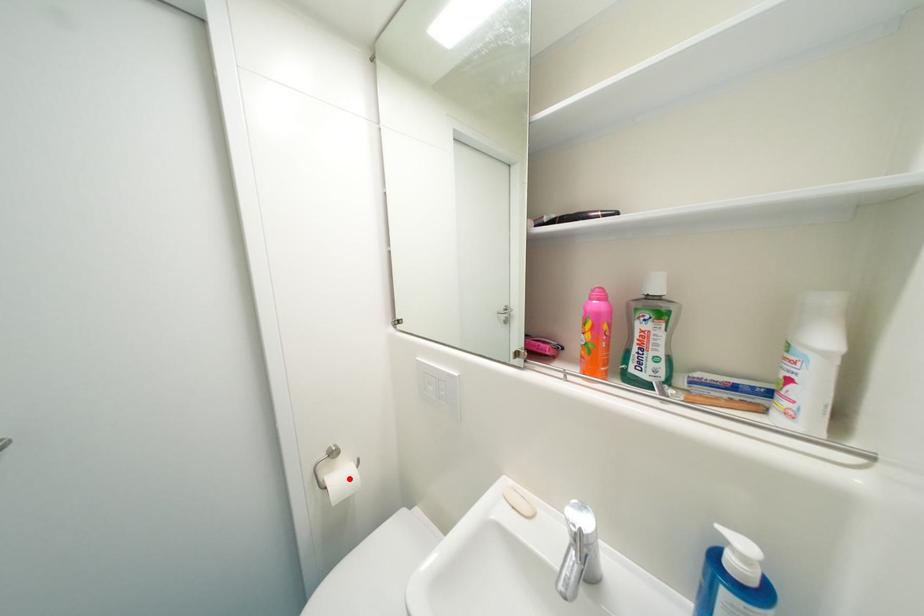
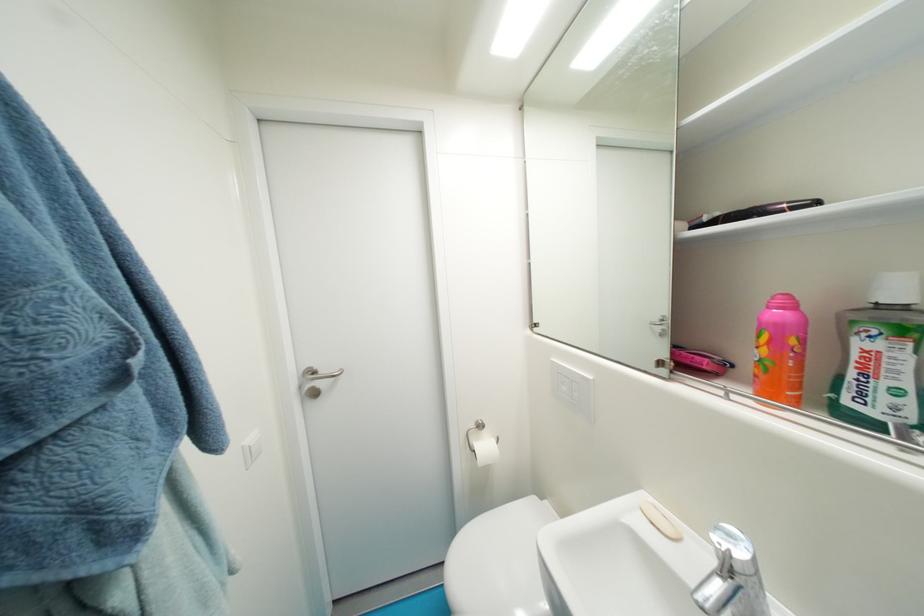
Question: I am providing you with two images of the same scene from different viewpoints. Image1 has a red point marked. In image2, the corresponding 3D location appears at what relative position? Reply with the corresponding letter.

Choices:
 (A) Closer
 (B) Farther

Answer: (B)